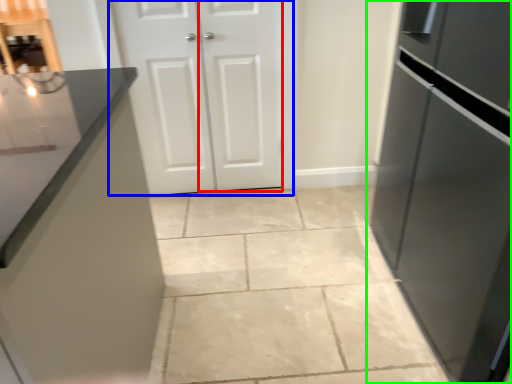
Question: Which is nearer to the door (highlighted by a red box)? door (highlighted by a blue box) or refrigerator (highlighted by a green box).

Choices:
 (A) door
 (B) refrigerator

Answer: (A)